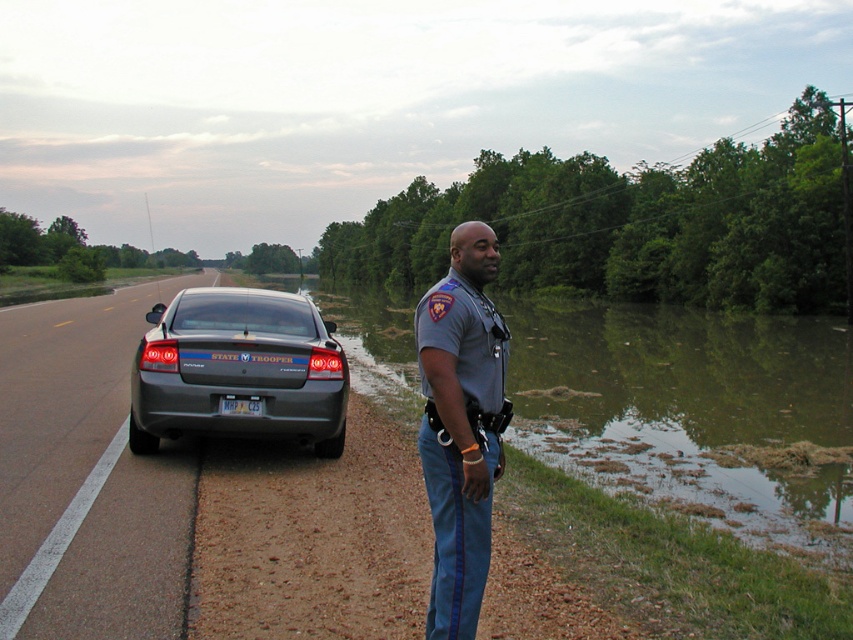
Question: Is green muddy water at right bigger than white plastic license plate at center?

Choices:
 (A) no
 (B) yes

Answer: (B)

Question: Is metallic gray car at center-left bigger than white plastic license plate at center?

Choices:
 (A) yes
 (B) no

Answer: (A)

Question: Which point appears closest to the camera in this image?

Choices:
 (A) (310, 380)
 (B) (439, 326)
 (C) (109, 536)
 (D) (244, 396)

Answer: (B)

Question: Which of these objects is positioned closest to the white plastic license plate at center?

Choices:
 (A) metallic gray car at center-left
 (B) green muddy water at right

Answer: (A)

Question: Which of the following is the farthest from the observer?

Choices:
 (A) (479, 435)
 (B) (160, 412)

Answer: (B)

Question: Is metallic gray car at center-left above gray uniform at center?

Choices:
 (A) yes
 (B) no

Answer: (A)